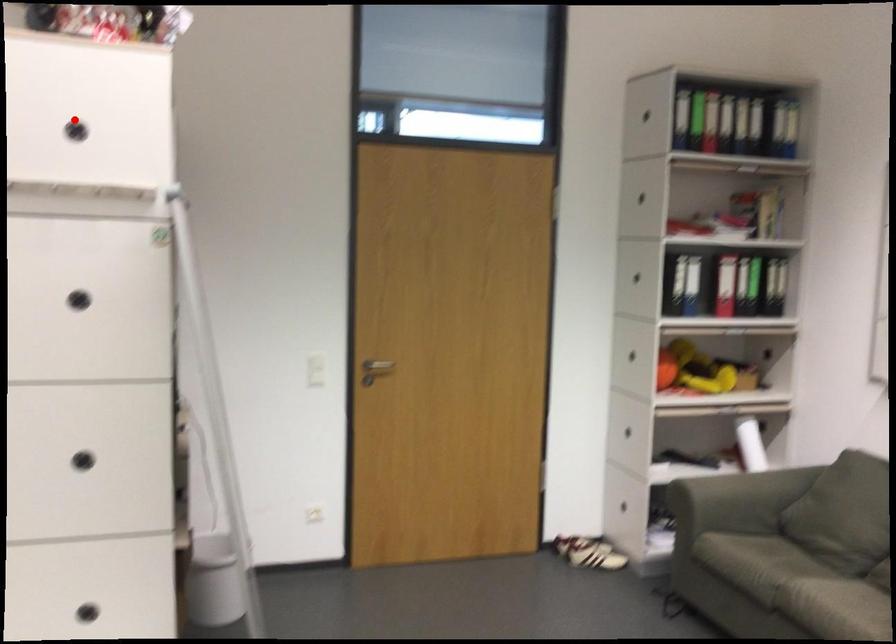
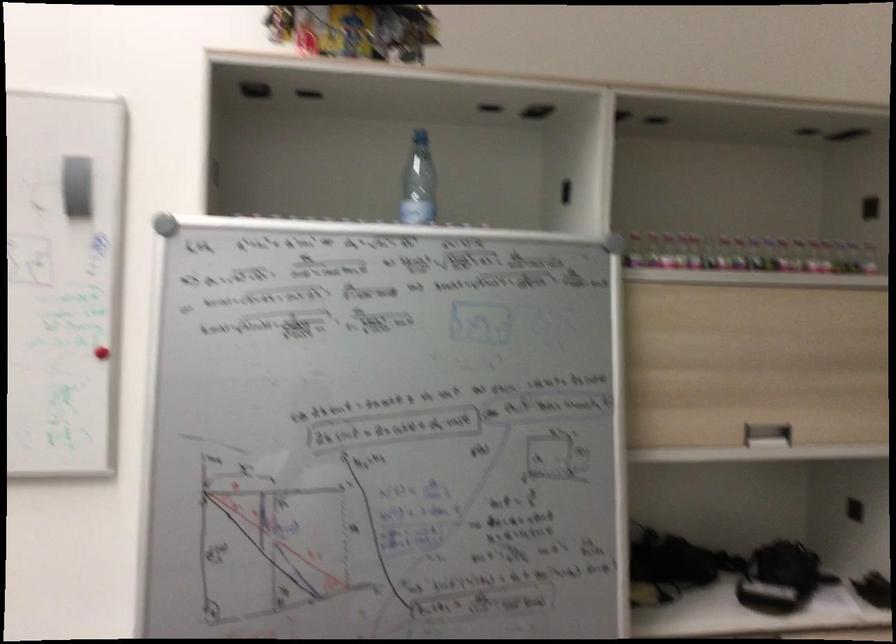
Question: I am providing you with two images of the same scene from different viewpoints. A red point is marked on the first image. Can you still see the location of the red point in image 2?

Choices:
 (A) Yes
 (B) No

Answer: (B)